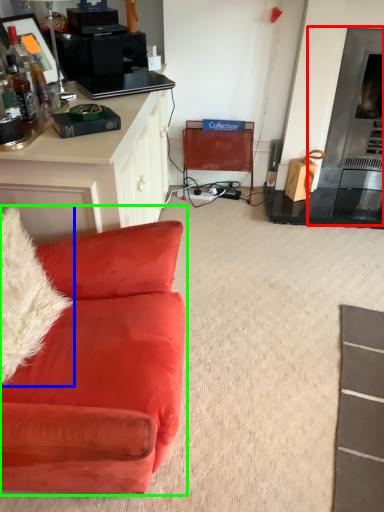
Question: Considering the real-world distances, which object is closest to fireplace (highlighted by a red box)? pillow (highlighted by a blue box) or studio couch (highlighted by a green box).

Choices:
 (A) pillow
 (B) studio couch

Answer: (B)